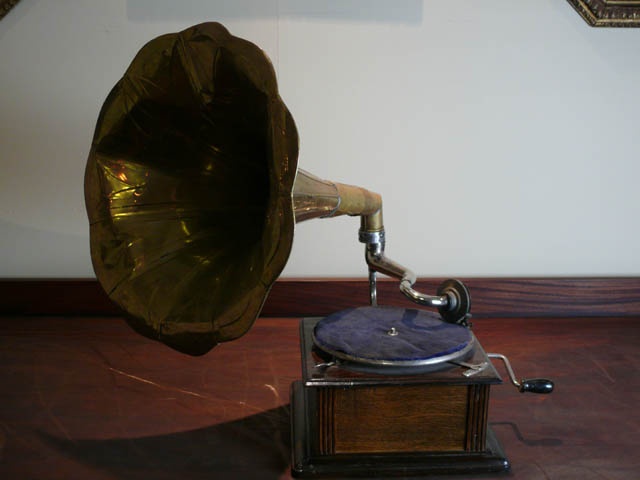
The image size is (640, 480). Identify the location of light blue wall. (68, 59), (473, 167), (572, 195), (466, 223), (20, 211), (317, 246), (480, 35).